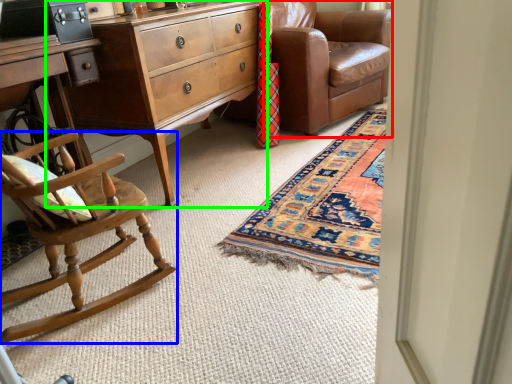
Question: Estimate the real-world distances between objects in this image. Which object is farther from studio couch (highlighted by a red box), chair (highlighted by a blue box) or nightstand (highlighted by a green box)?

Choices:
 (A) chair
 (B) nightstand

Answer: (A)